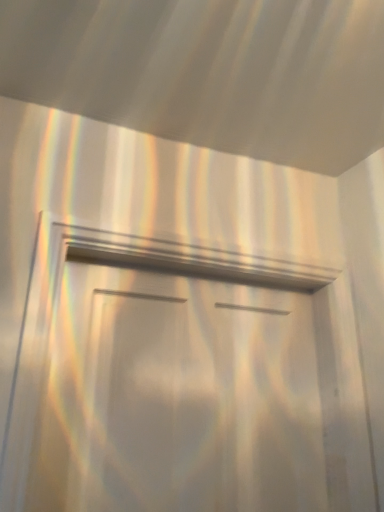
What is the approximate height of metallic silver door at center?

The height of metallic silver door at center is 25.76 inches.

Find the location of a particular element. This screenshot has height=512, width=384. metallic silver door at center is located at coordinates (193, 392).

The width and height of the screenshot is (384, 512). Describe the element at coordinates (193, 392) in the screenshot. I see `metallic silver door at center` at that location.

Where is `metallic silver door at center`? The height and width of the screenshot is (512, 384). metallic silver door at center is located at coordinates (193, 392).